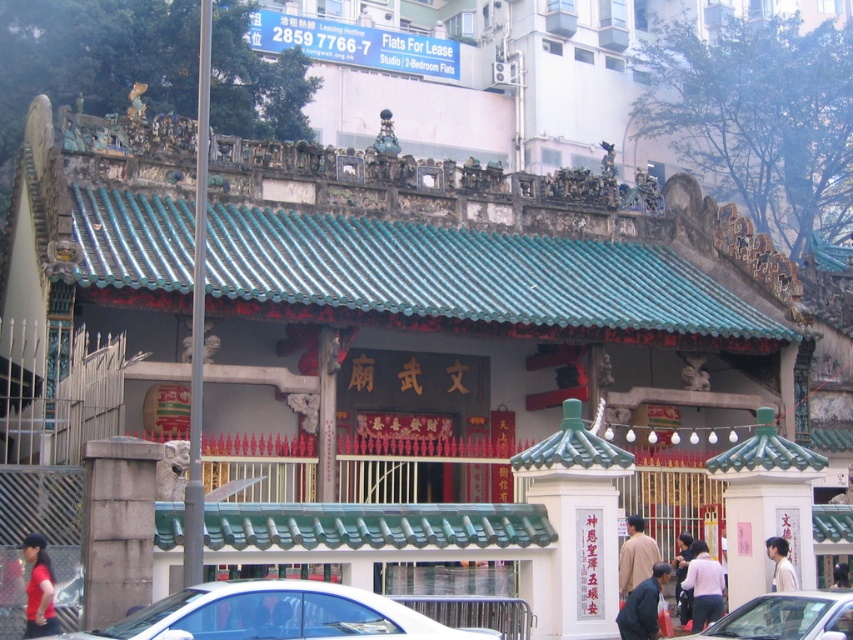
Is dark blue fabric jacket at lower center in front of light beige shirt at center?

No, it is behind light beige shirt at center.

Is dark blue fabric jacket at lower center thinner than light beige shirt at center?

No, dark blue fabric jacket at lower center is not thinner than light beige shirt at center.

At what (x,y) coordinates should I click in order to perform the action: click on dark blue fabric jacket at lower center. Please return your answer as a coordinate pair (x, y). The height and width of the screenshot is (640, 853). Looking at the image, I should click on (643, 605).

Does light pink fabric at center lie in front of brown matte shirt at center?

Yes, it is.

Does light pink fabric at center have a lesser height compared to brown matte shirt at center?

Yes, light pink fabric at center is shorter than brown matte shirt at center.

Is point (699, 589) more distant than point (621, 560)?

No, it is not.

The width and height of the screenshot is (853, 640). In order to click on light pink fabric at center in this screenshot , I will do `click(703, 586)`.

Can you confirm if green tile roof at center is shorter than matte red shirt at lower left?

No.

Is point (436, 314) positioned after point (39, 612)?

Yes, it is behind point (39, 612).

Image resolution: width=853 pixels, height=640 pixels. Describe the element at coordinates (473, 278) in the screenshot. I see `green tile roof at center` at that location.

At what (x,y) coordinates should I click in order to perform the action: click on green tile roof at center. Please return your answer as a coordinate pair (x, y). The image size is (853, 640). Looking at the image, I should click on point(473,278).